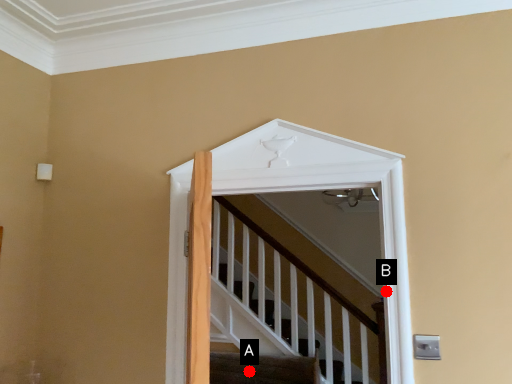
Question: Two points are circled on the image, labeled by A and B beside each circle. Which point appears closest to the camera in this image?

Choices:
 (A) A is closer
 (B) B is closer

Answer: (B)